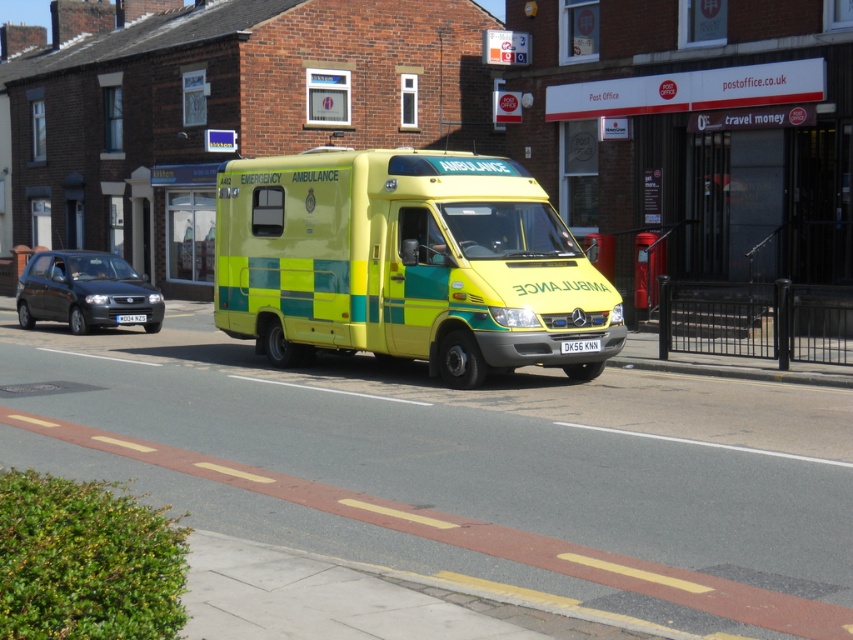
Consider the image. You are a driver trying to locate the black plastic license plate at center on the ambulance. Where would you look relative to the ambulance?

The black plastic license plate at center is located at the center of the ambulance, specifically at the coordinates point (579, 346).